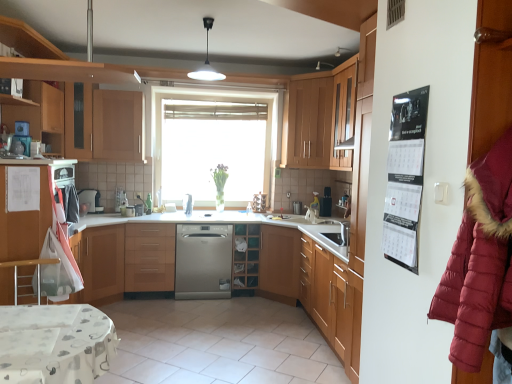
Find the location of a particular element. vacant point above white plastic table at lower left (from a real-world perspective) is located at coordinates (49, 333).